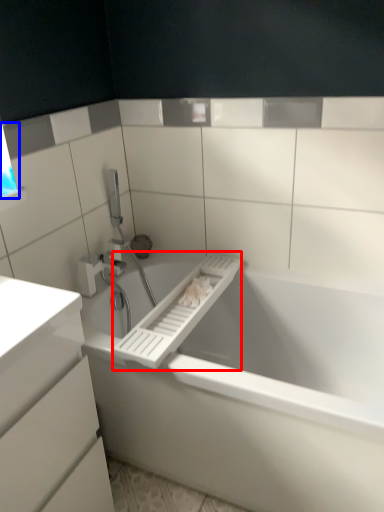
Question: Which object is further to the camera taking this photo, towel bar (highlighted by a red box) or window (highlighted by a blue box)?

Choices:
 (A) towel bar
 (B) window

Answer: (B)